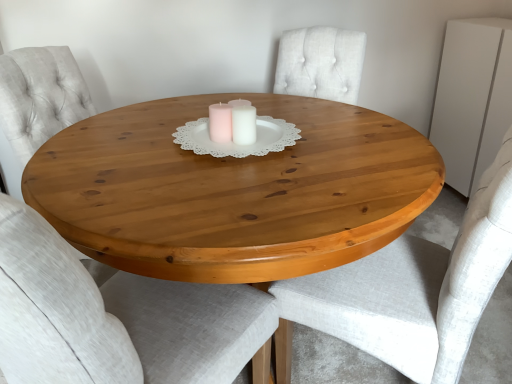
Question: Considering the relative sizes of white matte dresser at upper right and white matte candle at center in the image provided, is white matte dresser at upper right taller than white matte candle at center?

Choices:
 (A) no
 (B) yes

Answer: (B)

Question: Is white matte dresser at upper right not inside white matte candle at center?

Choices:
 (A) yes
 (B) no

Answer: (A)

Question: Does white matte dresser at upper right contain white matte candle at center?

Choices:
 (A) no
 (B) yes

Answer: (A)

Question: Is white matte dresser at upper right touching white matte candle at center?

Choices:
 (A) yes
 (B) no

Answer: (B)

Question: From the image's perspective, is white matte dresser at upper right on white matte candle at center?

Choices:
 (A) yes
 (B) no

Answer: (A)

Question: Does white matte dresser at upper right have a larger size compared to white matte candle at center?

Choices:
 (A) yes
 (B) no

Answer: (A)

Question: Is light gray fabric chair at center, arranged as the second chair when viewed from the right, aimed at natural wood table at center?

Choices:
 (A) no
 (B) yes

Answer: (B)

Question: Does light gray fabric chair at center, marked as the first chair in a left-to-right arrangement, come behind natural wood table at center?

Choices:
 (A) no
 (B) yes

Answer: (A)

Question: From a real-world perspective, is light gray fabric chair at center, marked as the first chair in a left-to-right arrangement, positioned under natural wood table at center based on gravity?

Choices:
 (A) yes
 (B) no

Answer: (B)

Question: Does light gray fabric chair at center, arranged as the second chair when viewed from the right, have a larger size compared to natural wood table at center?

Choices:
 (A) no
 (B) yes

Answer: (A)

Question: From the image's perspective, does light gray fabric chair at center, marked as the first chair in a left-to-right arrangement, appear higher than natural wood table at center?

Choices:
 (A) yes
 (B) no

Answer: (B)

Question: Can you confirm if light gray fabric chair at center, marked as the first chair in a left-to-right arrangement, is smaller than natural wood table at center?

Choices:
 (A) no
 (B) yes

Answer: (B)

Question: Can you confirm if light gray fabric chair at center, arranged as the second chair when viewed from the right, is taller than white matte dresser at upper right?

Choices:
 (A) no
 (B) yes

Answer: (B)